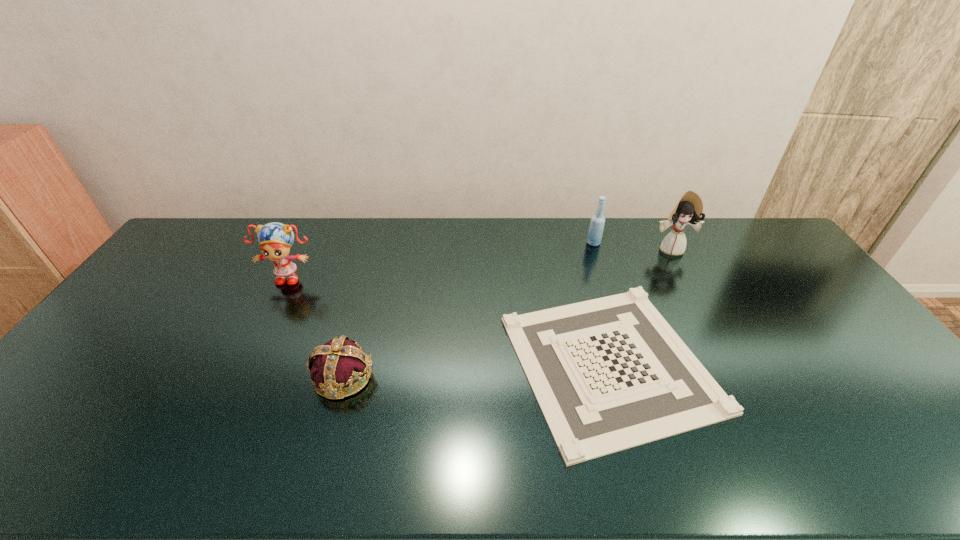
This screenshot has height=540, width=960. I want to click on blank region between the left doll and the second shortest object, so click(x=316, y=326).

The width and height of the screenshot is (960, 540). Identify the location of vacant space in between the farther doll and the bottle. (633, 246).

I want to click on free spot between the fourth object from right to left and the bottle, so click(468, 309).

This screenshot has width=960, height=540. I want to click on vacant space in between the bottle and the farther doll, so click(x=633, y=246).

The width and height of the screenshot is (960, 540). Find the location of `vacant space in between the fourth object from right to left and the third farthest object`. vacant space in between the fourth object from right to left and the third farthest object is located at coordinates (316, 326).

Where is `unoccupied area between the bottle and the right doll`? This screenshot has width=960, height=540. unoccupied area between the bottle and the right doll is located at coordinates (633, 246).

This screenshot has width=960, height=540. Identify the location of free space between the bottle and the right doll. (633, 246).

Locate an element on the screen. blank region between the bottle and the nearer doll is located at coordinates (442, 260).

Locate an element on the screen. This screenshot has width=960, height=540. vacant area that lies between the checkerboard and the second object from left to right is located at coordinates (476, 370).

Locate which object is the second closest to the bottle. Please provide its 2D coordinates. Your answer should be formatted as a tuple, i.e. [(x, y)], where the tuple contains the x and y coordinates of a point satisfying the conditions above.

[(609, 374)]